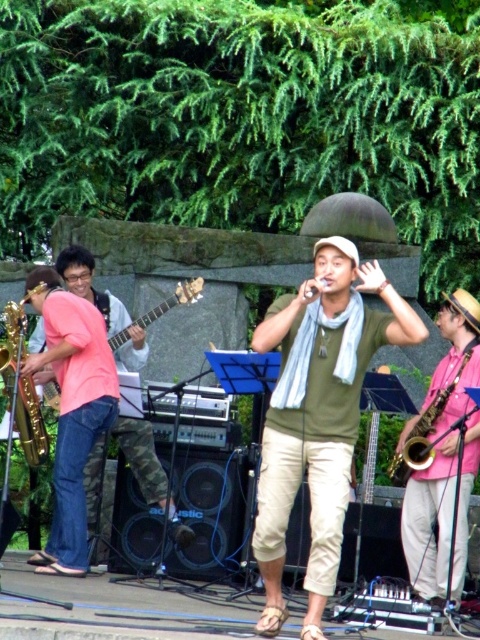
You are a photographer at the live performance. You want to capture a closeup shot of the singer in his green matte shirt at center while also including the satin gold saxophone at left in the background. Since the camera can only focus on one subject clearly, which object should you prioritize focusing on to ensure it appears sharp and in focus?

The green matte shirt at center is larger in size than the satin gold saxophone at left, so you should prioritize focusing on the green matte shirt at center to ensure it appears sharp and in focus.

You are standing at the center of the stage and want to move towards the point at the bottom right corner of the stage. However, there is an obstacle at point (x=342, y=368). Can you walk around it by moving towards point (x=33, y=412) first?

Point (x=342, y=368) is in front of point (x=33, y=412), so you cannot reach point (x=33, y=412) first because the obstacle is blocking the path.